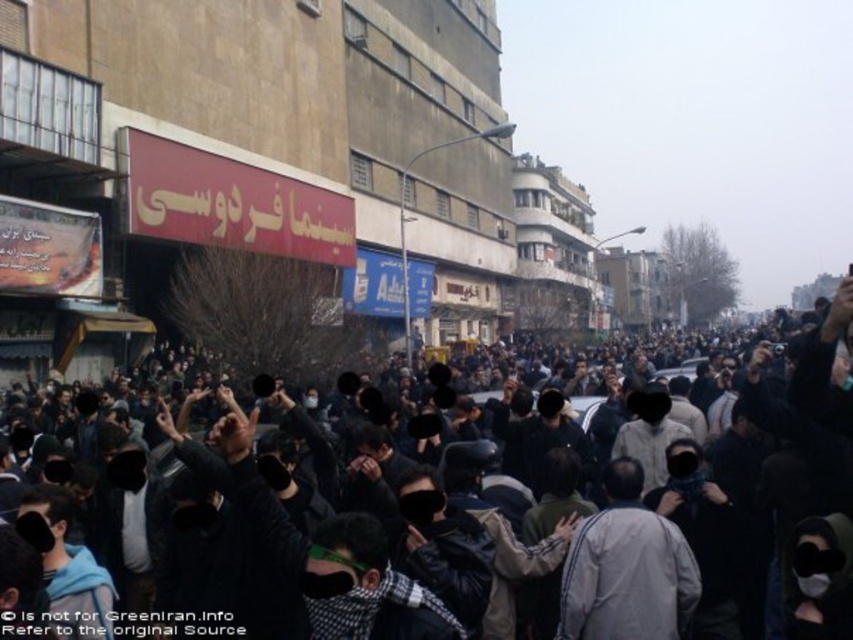
Question: Does dark clothing crowd at center have a greater width compared to light gray fabric jacket at center?

Choices:
 (A) yes
 (B) no

Answer: (A)

Question: Among these objects, which one is nearest to the camera?

Choices:
 (A) light gray fabric jacket at center
 (B) dark clothing crowd at center

Answer: (B)

Question: Which point is closer to the camera taking this photo?

Choices:
 (A) (610, 499)
 (B) (428, 596)

Answer: (B)

Question: Can you confirm if dark clothing crowd at center is positioned below light gray fabric jacket at center?

Choices:
 (A) no
 (B) yes

Answer: (A)

Question: Can you confirm if dark clothing crowd at center is wider than light gray fabric jacket at center?

Choices:
 (A) no
 (B) yes

Answer: (B)

Question: Which point is closer to the camera taking this photo?

Choices:
 (A) (695, 531)
 (B) (639, 516)

Answer: (B)